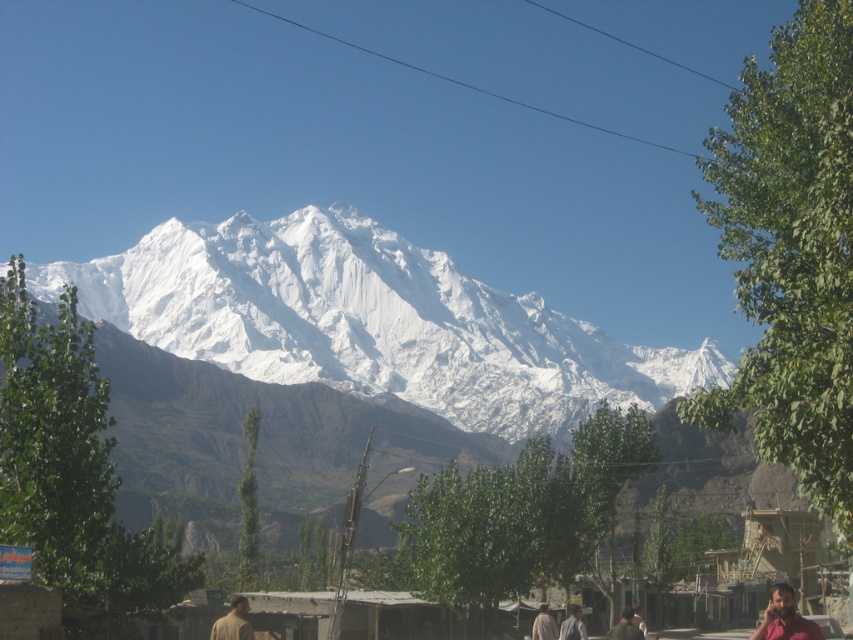
Between point (584, 636) and point (550, 628), which one is positioned in front?

Positioned in front is point (584, 636).

Find the location of a particular element. The width and height of the screenshot is (853, 640). brown fabric shirt at lower center is located at coordinates (572, 625).

Between point (569, 620) and point (556, 636), which one is positioned in front?

Point (556, 636) is in front.

What are the coordinates of `brown fabric shirt at lower center` in the screenshot? It's located at point(572,625).

Who is more forward, (219, 636) or (543, 614)?

Point (219, 636)

Measure the distance between point (236,605) and camera.

641.25 feet

Between point (236, 620) and point (538, 627), which one is positioned in front?

Point (236, 620) is more forward.

Locate an element on the screen. This screenshot has height=640, width=853. brown matte shirt at lower center is located at coordinates (233, 621).

Is brown matte shirt at lower center bigger than brown fabric shirt at lower center?

Yes.

Describe the element at coordinates (233, 621) in the screenshot. I see `brown matte shirt at lower center` at that location.

I want to click on brown matte shirt at lower center, so click(x=233, y=621).